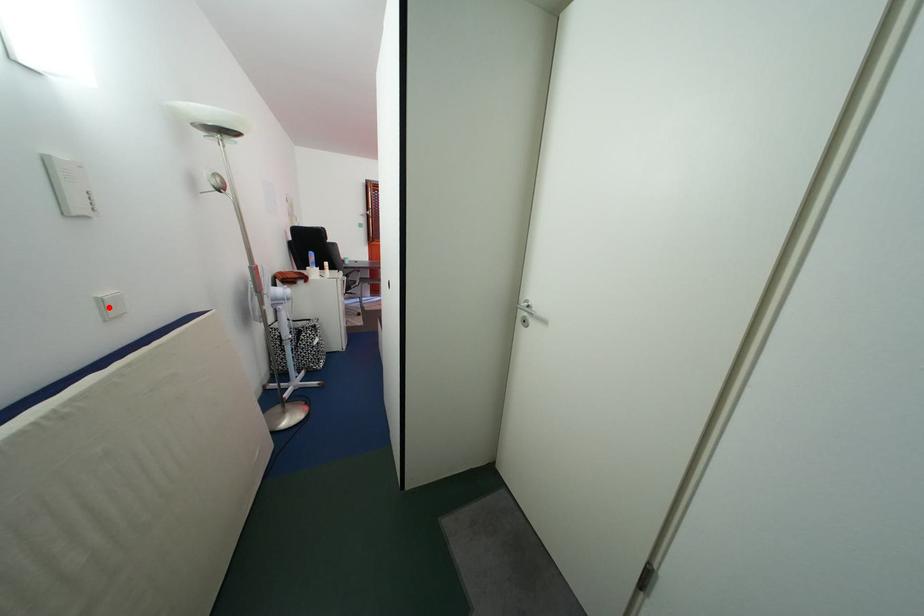
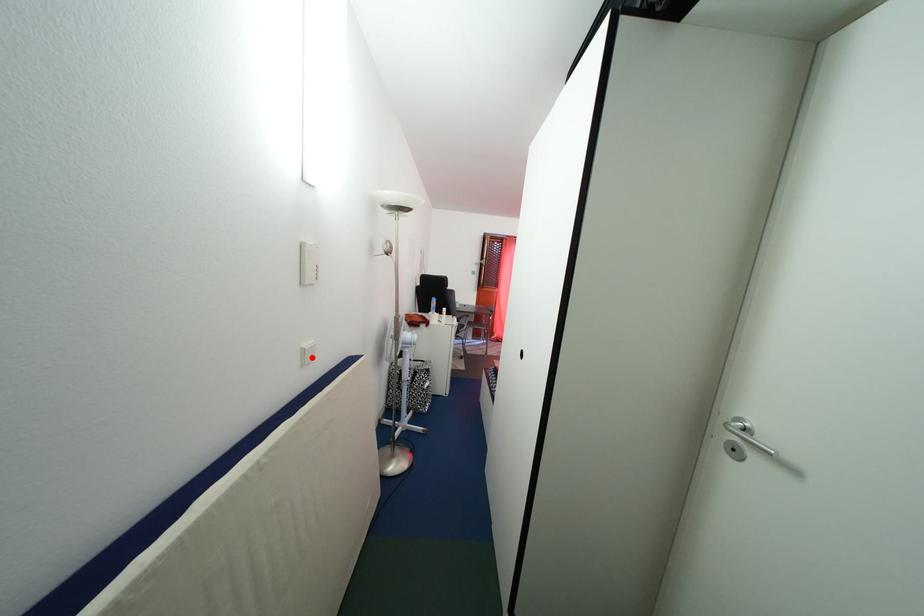
I am providing you with two images of the same scene from different viewpoints. A red point is marked on the first image and another point is marked on the second image. Do the highlighted points in image1 and image2 indicate the same real-world spot?

Yes